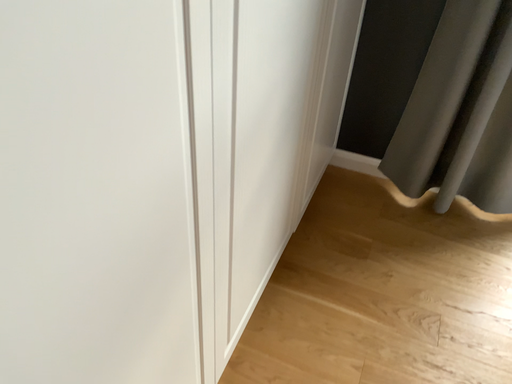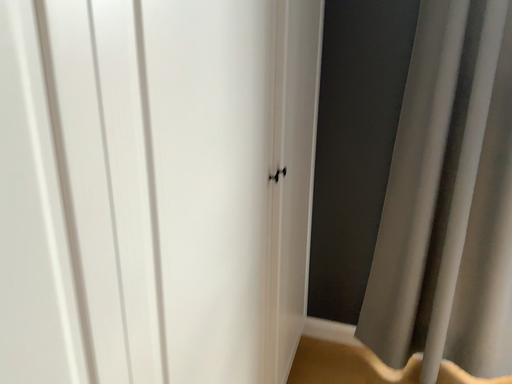
Question: Which way did the camera rotate in the video?

Choices:
 (A) rotated upward
 (B) rotated downward

Answer: (A)